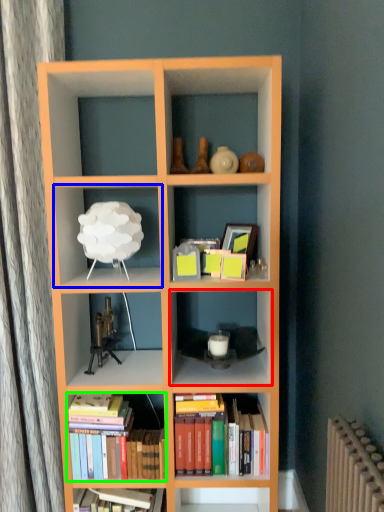
Question: Which object is the farthest from shelf (highlighted by a red box)? Choose among these: shelf (highlighted by a blue box) or book (highlighted by a green box).

Choices:
 (A) shelf
 (B) book

Answer: (A)